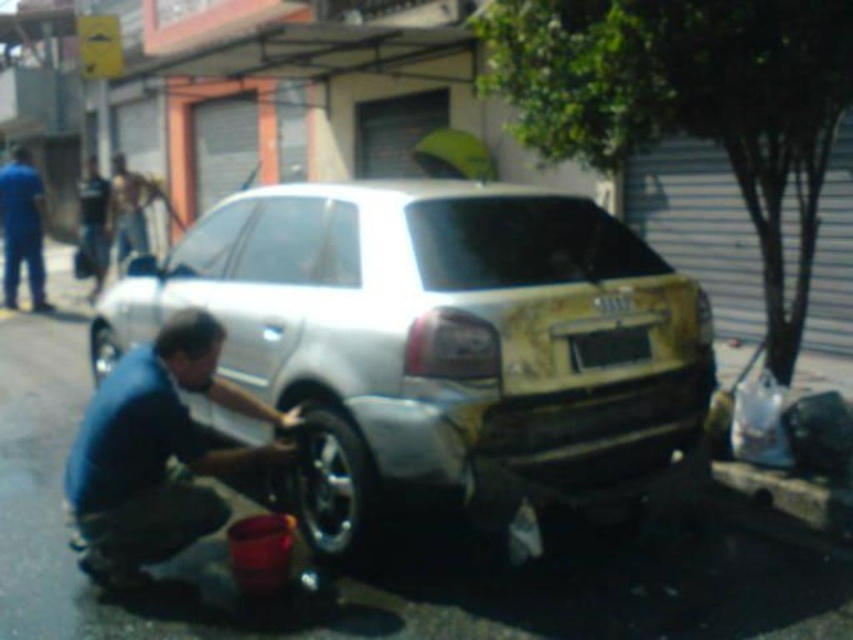
You are a delivery person who needs to load a large package onto a truck. The truck can only carry items smaller than the silver metallic car at center. Can the black rubber tire at lower center fit on the truck?

The silver metallic car at center is bigger than the black rubber tire at lower center. Since the truck can carry items smaller than the car, the black rubber tire at lower center can fit on the truck.

Looking at this image, you are a pedestrian passing by the scene. You notice a black rubber tire at lower center and a blue uniform at left. Which object is positioned more to the left side of the scene?

The blue uniform at left is positioned more to the left side of the scene than the black rubber tire at lower center.